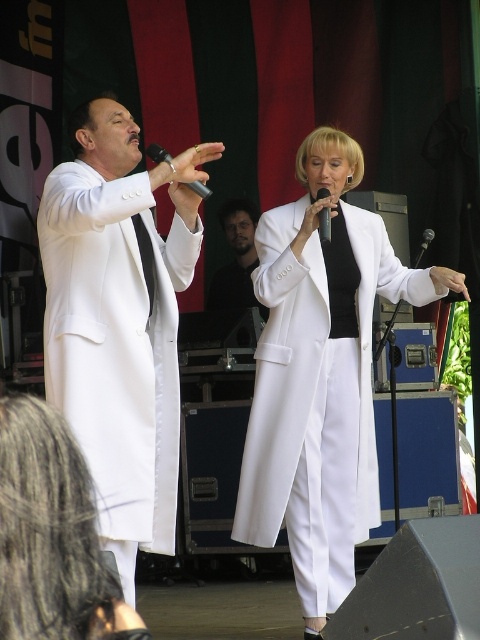
Question: Can you confirm if white glossy coat at center is bigger than black plastic microphone at center?

Choices:
 (A) yes
 (B) no

Answer: (A)

Question: Can you confirm if white glossy coat at center is thinner than black plastic microphone at center?

Choices:
 (A) no
 (B) yes

Answer: (A)

Question: Which point is closer to the camera taking this photo?

Choices:
 (A) (82, 486)
 (B) (324, 227)
 (C) (54, 211)

Answer: (A)

Question: Based on their relative distances, which object is farther from the white matte coat at center?

Choices:
 (A) matte white coat at left
 (B) black matte microphone at upper center
 (C) white glossy coat at center

Answer: (C)

Question: Which of the following is the farthest from the observer?

Choices:
 (A) (195, 192)
 (B) (406, 269)
 (C) (173, 461)
 (D) (11, 483)

Answer: (B)

Question: Can you confirm if white matte coat at center is bigger than white glossy coat at center?

Choices:
 (A) no
 (B) yes

Answer: (B)